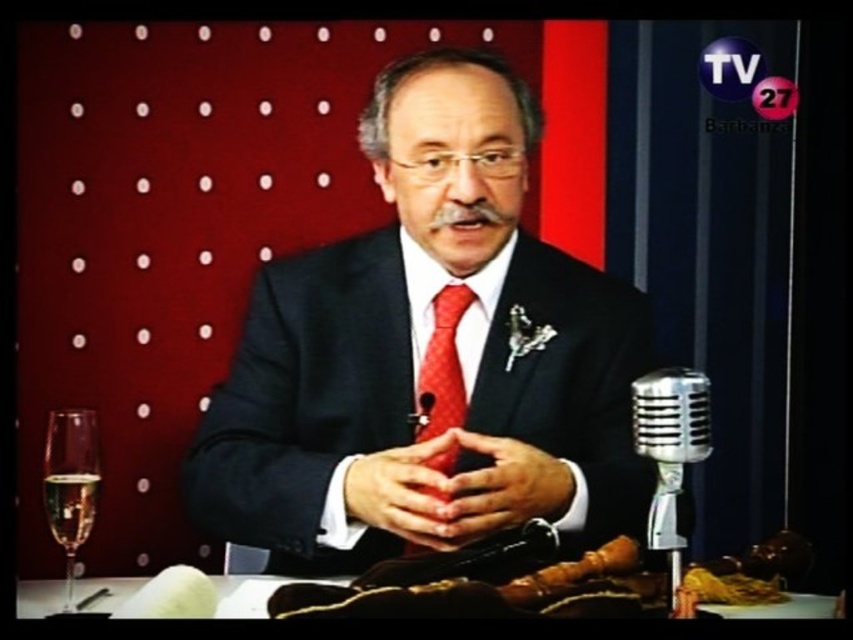
Question: Which point is farther to the camera?

Choices:
 (A) (485, 488)
 (B) (56, 477)
 (C) (722, 614)
 (D) (70, 493)

Answer: (A)

Question: Can you confirm if clear glass wine glass at lower left is positioned above clear glass champagne flute at lower left?

Choices:
 (A) no
 (B) yes

Answer: (A)

Question: Which of these objects is positioned closest to the white fabric table at lower center?

Choices:
 (A) clear glass champagne flute at lower left
 (B) matte red heart at center
 (C) clear glass wine glass at lower left
 (D) matte black hands at center

Answer: (C)

Question: Is white fabric table at lower center thinner than clear glass wine glass at lower left?

Choices:
 (A) yes
 (B) no

Answer: (B)

Question: Which object is farther from the camera taking this photo?

Choices:
 (A) white fabric table at lower center
 (B) matte black suit at center

Answer: (B)

Question: Is silver metallic microphone at lower right to the left of white fabric table at lower center from the viewer's perspective?

Choices:
 (A) yes
 (B) no

Answer: (B)